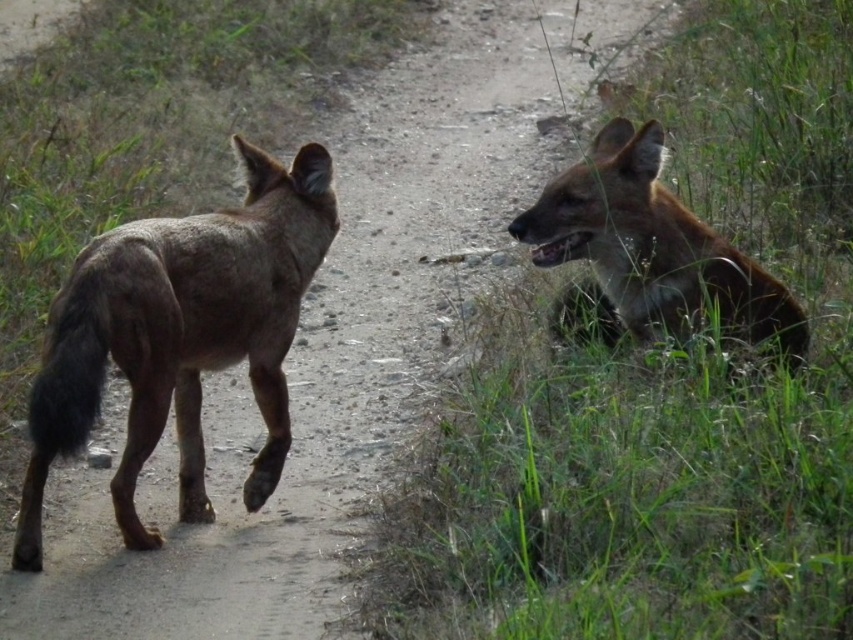
Looking at this image, you are a photographer trying to capture a clear shot of the brown fur hyaena at right. However, the green grass at lower right is blocking part of the view. Can you adjust your position to see the hyaena without the grass blocking it?

The green grass at lower right is closer to the viewer than the brown fur hyaena at right, so moving your position slightly to the left or right might allow you to see the hyaena behind the grass.

You are a hiker who wants to step onto the path between the green grass at lower right and the brown fur dog at left. Can you safely step there without stepping on the grass?

The green grass at lower right is not as tall as brown fur dog at left, so the grass is shorter. However, the grass is still part of the path, so stepping there might still involve stepping on the grass. The question is about avoiding the grass, but since the path includes grass, it might not be possible to avoid it entirely. However, the grass being shorter might make it easier to step without getting caught, but the presence of the grass means you can not completely avoid it. The answer should clarify the

You are a photographer trying to capture both animals in a single shot. You notice two specific points marked in the image. The first point is at coordinates point (515, 445) and the second is at point (166, 371). Which point is closer to your camera lens?

Point (515, 445) is closer to the camera lens than point (166, 371) because it is further to the camera according to the description.